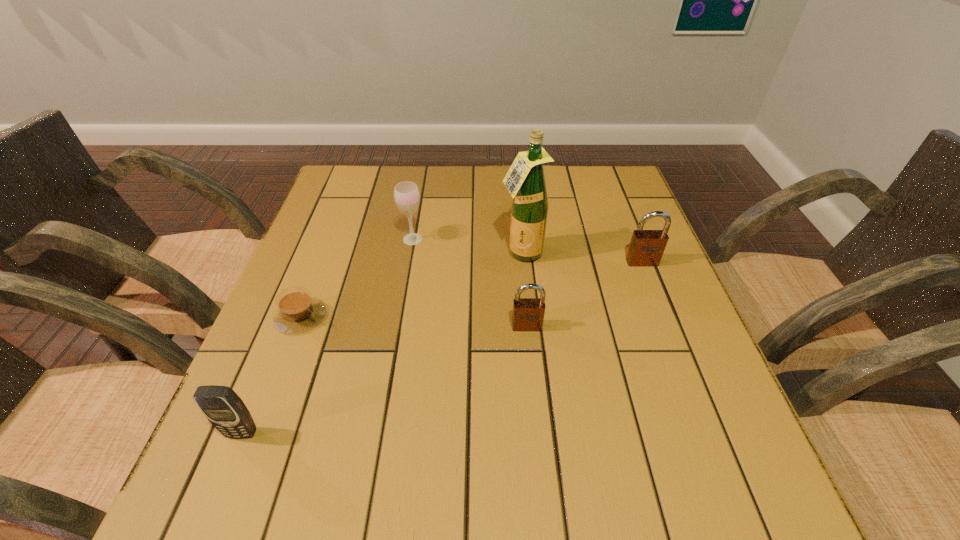
Locate an element on the screen. The image size is (960, 540). free space between the cappuccino and the liquor is located at coordinates pyautogui.click(x=411, y=285).

The width and height of the screenshot is (960, 540). What are the coordinates of `vacant area that lies between the tallest object and the cellular telephone` in the screenshot? It's located at (382, 343).

You are a GUI agent. You are given a task and a screenshot of the screen. Output one action in this format:
    pyautogui.click(x=<x>, y=<y>)
    Task: Click on the vacant area that lies between the shortest object and the third object from left to right
    The width and height of the screenshot is (960, 540).
    Given the screenshot: What is the action you would take?
    pyautogui.click(x=357, y=278)

At what (x,y) coordinates should I click in order to perform the action: click on free space between the liquor and the cellular telephone. Please return your answer as a coordinate pair (x, y). The height and width of the screenshot is (540, 960). Looking at the image, I should click on (382, 343).

You are a GUI agent. You are given a task and a screenshot of the screen. Output one action in this format:
    pyautogui.click(x=<x>, y=<y>)
    Task: Click on the object that is the fifth closest to the cellular telephone
    The width and height of the screenshot is (960, 540).
    Given the screenshot: What is the action you would take?
    pyautogui.click(x=646, y=248)

This screenshot has height=540, width=960. Find the location of `the fourth closest object to the fourth object from right to left`. the fourth closest object to the fourth object from right to left is located at coordinates (646, 248).